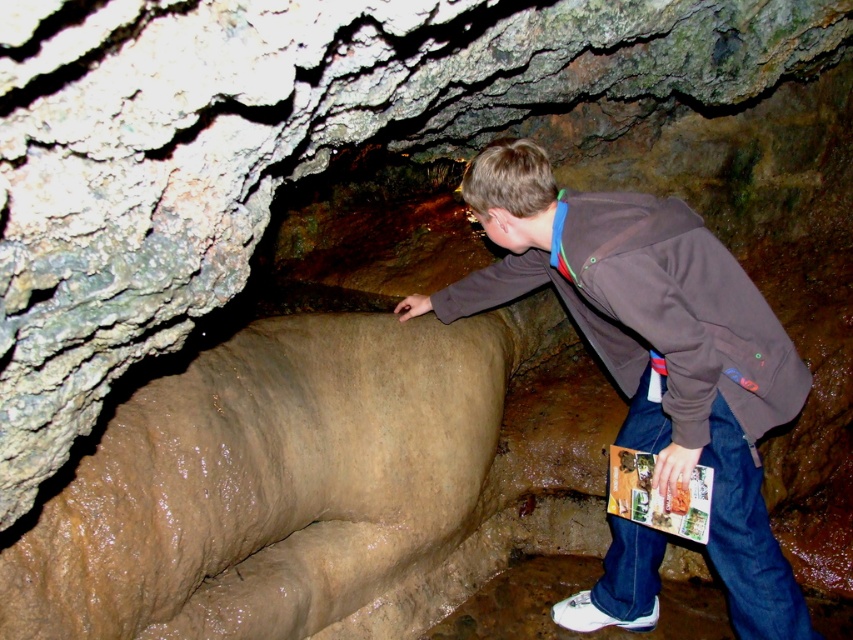
You are navigating through the cave and need to determine the order of two points marked on your map. According to the image, which point is farther away from the entrance, point 1 at coordinates (x=753, y=435) or point 2 at (x=778, y=372)?

Point 1 at coordinates (x=753, y=435) is farther away from the entrance because it is behind point 2 at (x=778, y=372).

You are an explorer in the cave and see both the brown cotton hoodie at center and the brown cotton jacket at center. Which one is positioned to the right side?

The brown cotton hoodie at center is positioned to the right of the brown cotton jacket at center.

Looking at this image, you are an explorer in a cave and see a brown cotton hoodie at center and a brown cotton jacket at center. Which clothing item is taller?

The brown cotton hoodie at center is much taller than the brown cotton jacket at center.